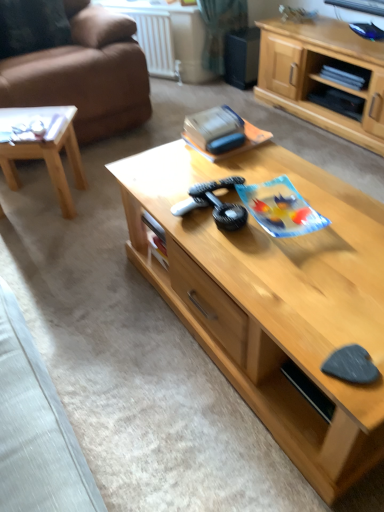
Where is `empty space that is ontop of light wood coffee table at center, which is counted as the second coffee table, starting from the left`? empty space that is ontop of light wood coffee table at center, which is counted as the second coffee table, starting from the left is located at coordinates (279, 216).